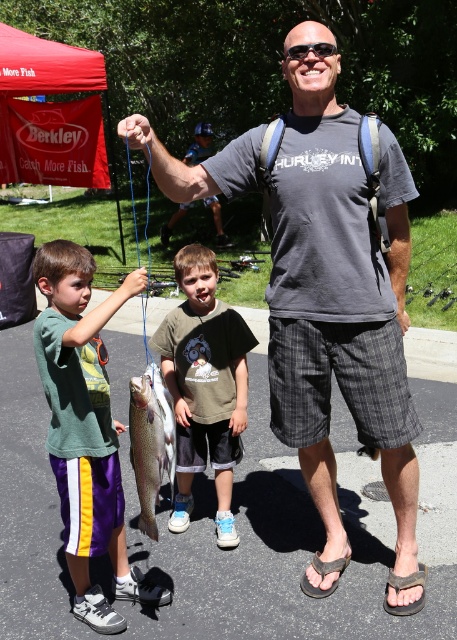
You are a photographer positioned in front of the scene. You want to take a photo that includes both the green fabric shirt at left and the shiny silver fish at center. Which object should you focus on first to ensure both are in clear view?

You should focus on the green fabric shirt at left first because it is closer to you than the shiny silver fish at center. By focusing on the closer object, both will be in clear view due to the overlapping depth of field.

You are a photographer at the event and need to capture a photo that includes both the green fabric shirt at left and the shiny silver fish at center. Which object should you focus on first to ensure it is fully visible in the frame?

The green fabric shirt at left is bigger than the shiny silver fish at center, so you should focus on the green fabric shirt at left first to ensure it fits within the frame before adjusting for the smaller shiny silver fish at center.